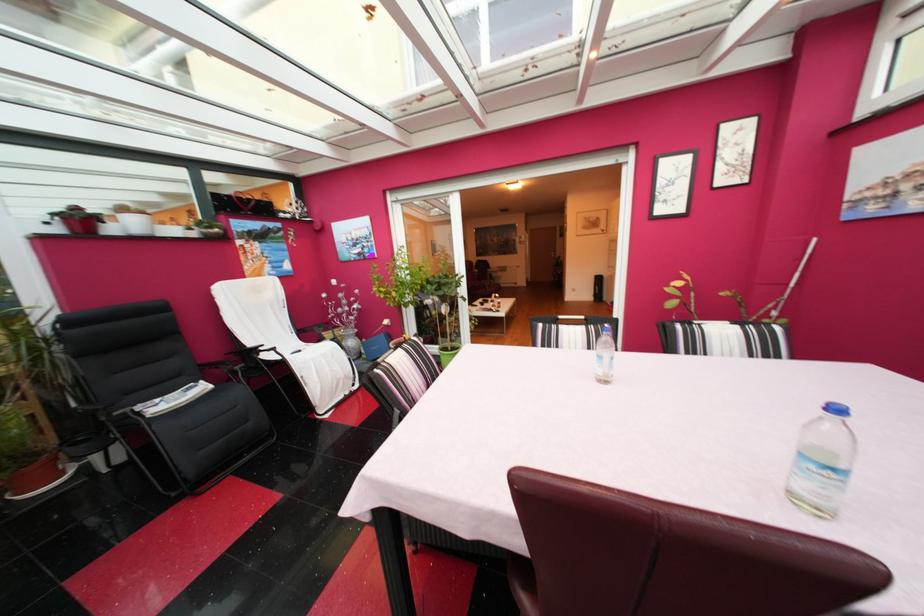
Identify the location of folded newspaper. Image resolution: width=924 pixels, height=616 pixels. (173, 399).